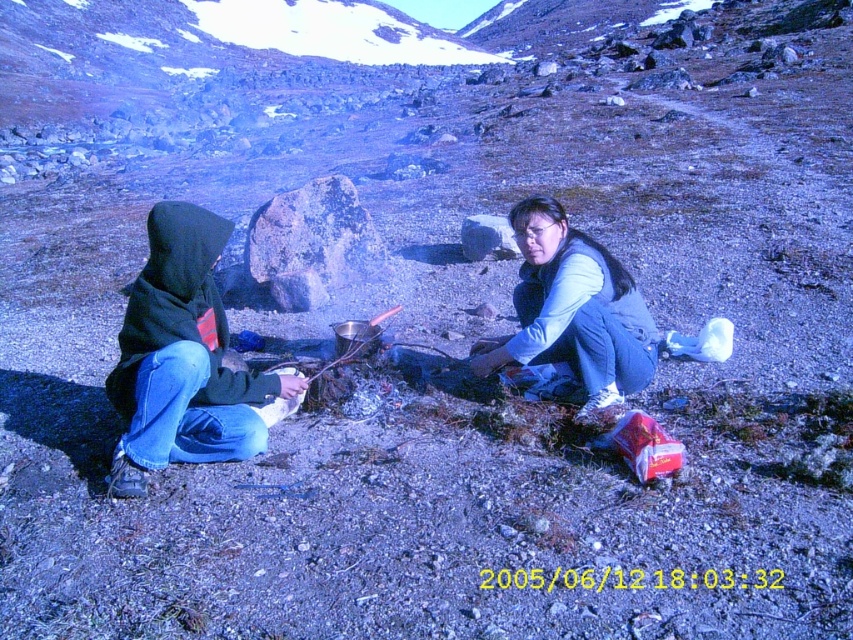
You are planning to take a photo of the two people in the scene. The camera you are using has a depth of field that can only focus on objects with a thickness between 0.5cm and 2cm. Given that the black fleece jacket at left is thinner than the blue denim jeans at lower right, will both objects be in focus?

The black fleece jacket at left is thinner than the blue denim jeans at lower right. Since the camera can focus on objects between 0.5cm and 2cm thick, both objects will be in focus as long as their thicknesses fall within this range. However, without exact measurements, we can only confirm that the black fleece jacket is within the range if it is at least 0.5cm thick, and the jeans are up to 2cm thick. The description only states the jacket is thinner than the jeans, so if the jeans are within 2cm, bothare

You are a photographer trying to capture a photo of both the black fleece jacket at left and the blue denim jeans at lower right in the same frame. Based on their positions, which object should you focus on first to ensure both are in focus?

The black fleece jacket at left is positioned on the left side of blue denim jeans at lower right. To ensure both are in focus, you should focus on the black fleece jacket at left first, as it is closer to the photographer, and the depth of field will extend to the blue denim jeans at lower right.